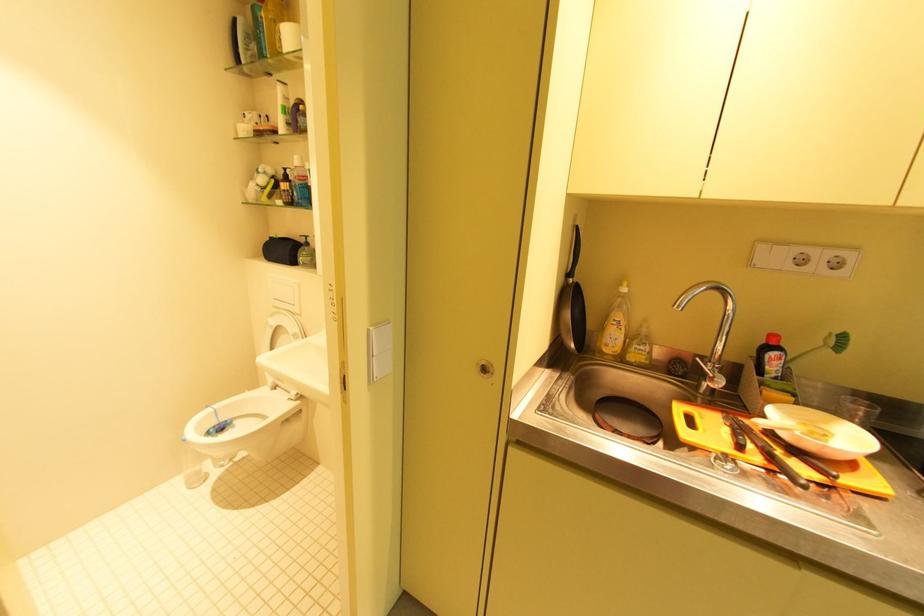
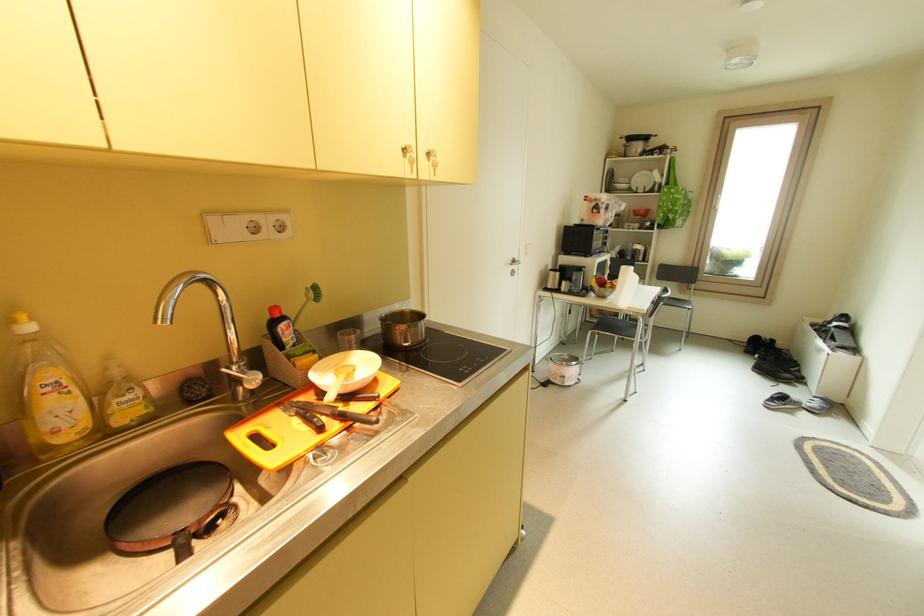
Locate, in the second image, the point that corresponds to the point at 711,365 in the first image.

(237, 370)